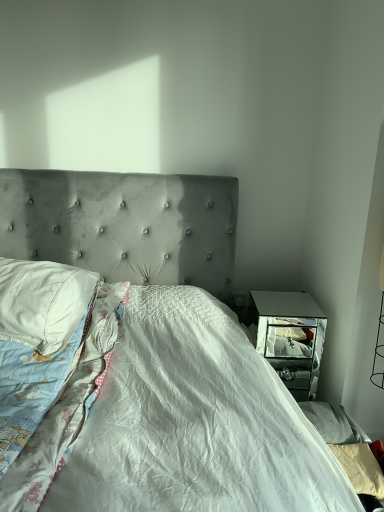
Question: Does velvet gray bed at center appear on the right side of white cotton pillow at left?

Choices:
 (A) no
 (B) yes

Answer: (B)

Question: Is there a large distance between velvet gray bed at center and white cotton pillow at left?

Choices:
 (A) no
 (B) yes

Answer: (A)

Question: Is velvet gray bed at center located outside white cotton pillow at left?

Choices:
 (A) no
 (B) yes

Answer: (B)

Question: Considering the relative positions of velvet gray bed at center and white cotton pillow at left in the image provided, is velvet gray bed at center to the left of white cotton pillow at left from the viewer's perspective?

Choices:
 (A) no
 (B) yes

Answer: (A)

Question: Is velvet gray bed at center smaller than white cotton pillow at left?

Choices:
 (A) no
 (B) yes

Answer: (A)

Question: Based on their sizes in the image, would you say white cotton pillow at left is bigger or smaller than velvet gray bed at center?

Choices:
 (A) small
 (B) big

Answer: (A)

Question: From a real-world perspective, relative to velvet gray bed at center, is white cotton pillow at left vertically above or below?

Choices:
 (A) below
 (B) above

Answer: (B)

Question: Relative to velvet gray bed at center, is white cotton pillow at left in front or behind?

Choices:
 (A) front
 (B) behind

Answer: (B)

Question: Would you say white cotton pillow at left is to the left or to the right of velvet gray bed at center in the picture?

Choices:
 (A) right
 (B) left

Answer: (B)

Question: In the image, is velvet gray bed at center on the left side or the right side of white cotton blanket at left?

Choices:
 (A) left
 (B) right

Answer: (B)

Question: Is velvet gray bed at center bigger or smaller than white cotton blanket at left?

Choices:
 (A) small
 (B) big

Answer: (B)

Question: Considering the positions of velvet gray bed at center and white cotton blanket at left in the image, is velvet gray bed at center taller or shorter than white cotton blanket at left?

Choices:
 (A) tall
 (B) short

Answer: (A)

Question: Is velvet gray bed at center inside the boundaries of white cotton blanket at left, or outside?

Choices:
 (A) inside
 (B) outside

Answer: (B)

Question: Considering the positions of velvet gray bed at center and white cotton pillow at left in the image, is velvet gray bed at center bigger or smaller than white cotton pillow at left?

Choices:
 (A) big
 (B) small

Answer: (A)

Question: Is velvet gray bed at center to the left or to the right of white cotton pillow at left in the image?

Choices:
 (A) left
 (B) right

Answer: (B)